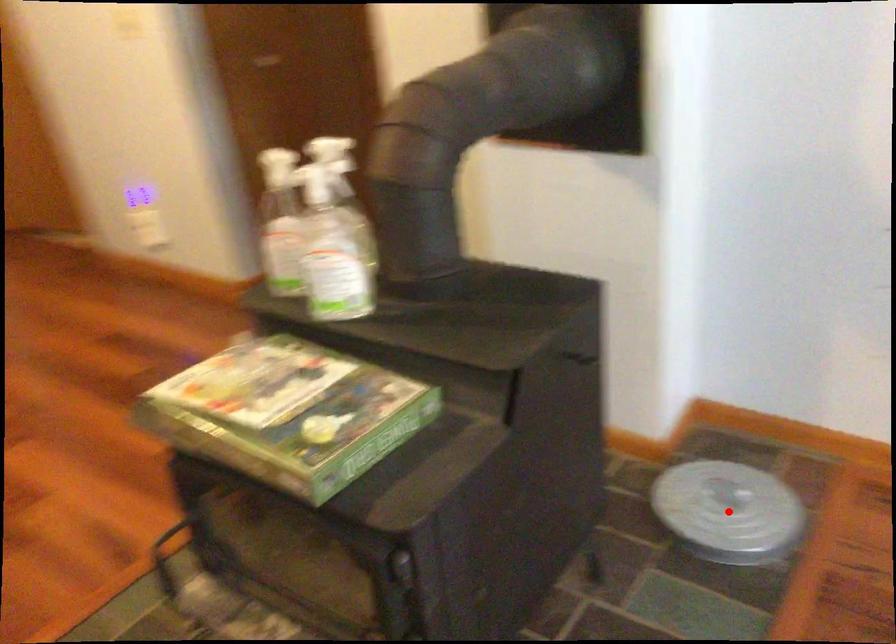
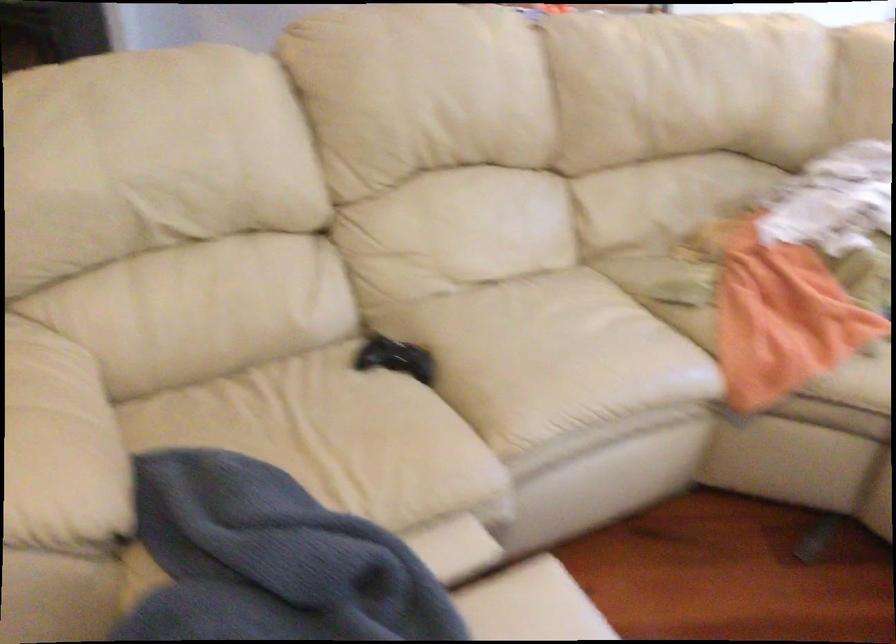
Question: I am providing you with two images of the same scene from different viewpoints. A red point is marked on the first image. Is the red point's position out of view in image 2?

Choices:
 (A) Yes
 (B) No

Answer: (A)